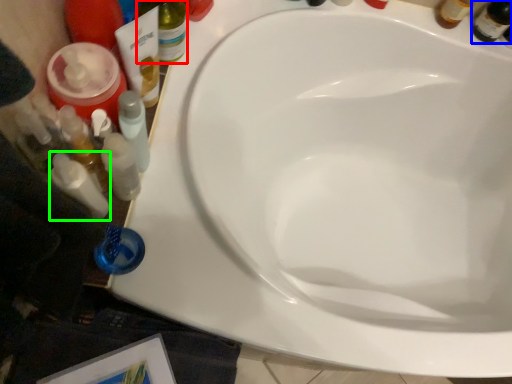
Question: Considering the real-world distances, which object is farthest from bottle (highlighted by a red box)? beer bottle (highlighted by a blue box) or toiletry (highlighted by a green box)?

Choices:
 (A) beer bottle
 (B) toiletry

Answer: (A)